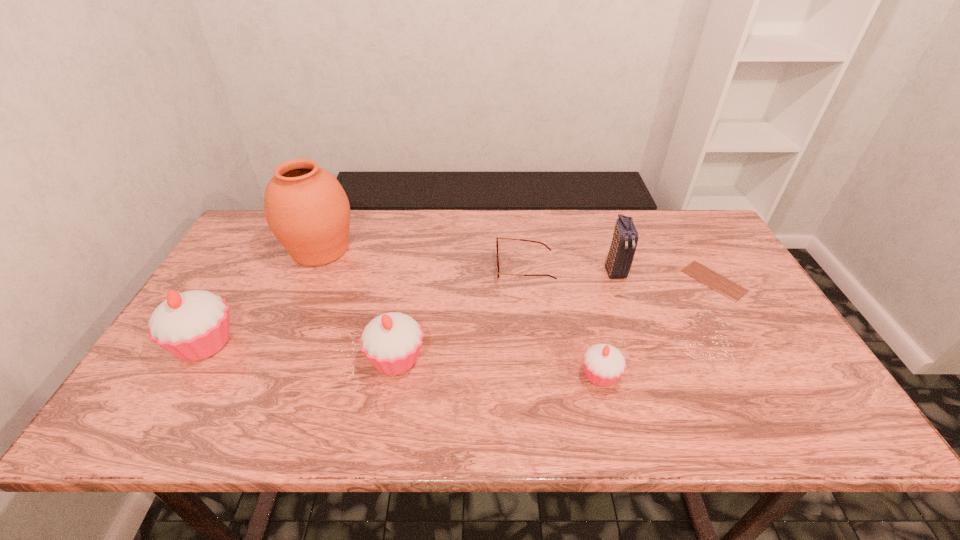
Identify the location of vacant space at the right edge of the desktop. The width and height of the screenshot is (960, 540). (738, 272).

At what (x,y) coordinates should I click in order to perform the action: click on blank area at the near left corner. Please return your answer as a coordinate pair (x, y). Looking at the image, I should click on (172, 392).

You are a GUI agent. You are given a task and a screenshot of the screen. Output one action in this format:
    pyautogui.click(x=<x>, y=<y>)
    Task: Click on the vacant space at the far right corner of the desktop
    Image resolution: width=960 pixels, height=540 pixels.
    Given the screenshot: What is the action you would take?
    pyautogui.click(x=680, y=230)

Locate an element on the screen. Image resolution: width=960 pixels, height=540 pixels. vacant space at the near right corner is located at coordinates (803, 379).

Where is `vacant area that lies between the clutch bag and the leftmost cupcake`? vacant area that lies between the clutch bag and the leftmost cupcake is located at coordinates (410, 307).

Locate an element on the screen. This screenshot has width=960, height=540. free space between the leftmost cupcake and the second shortest object is located at coordinates (365, 306).

Where is `free spot between the third shortest object and the chocolate bar`? This screenshot has width=960, height=540. free spot between the third shortest object and the chocolate bar is located at coordinates (658, 328).

Where is `empty space between the rightmost object and the sixth object from left to right`? empty space between the rightmost object and the sixth object from left to right is located at coordinates (664, 276).

At what (x,y) coordinates should I click in order to perform the action: click on vacant point located between the clutch bag and the urn. Please return your answer as a coordinate pair (x, y). Looking at the image, I should click on (468, 260).

Locate an element on the screen. The width and height of the screenshot is (960, 540). free spot between the shortest cupcake and the shortest object is located at coordinates (658, 328).